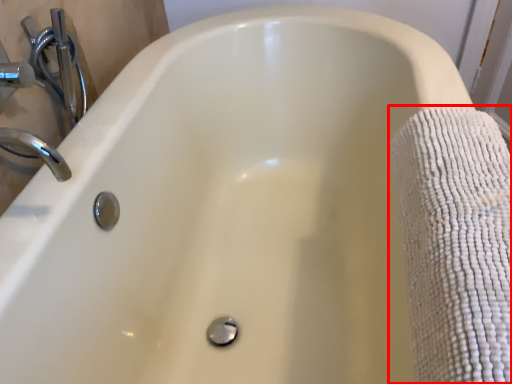
Question: Observing the image, what is the correct spatial positioning of bath towel (annotated by the red box) in reference to plumbing fixture?

Choices:
 (A) left
 (B) right

Answer: (B)